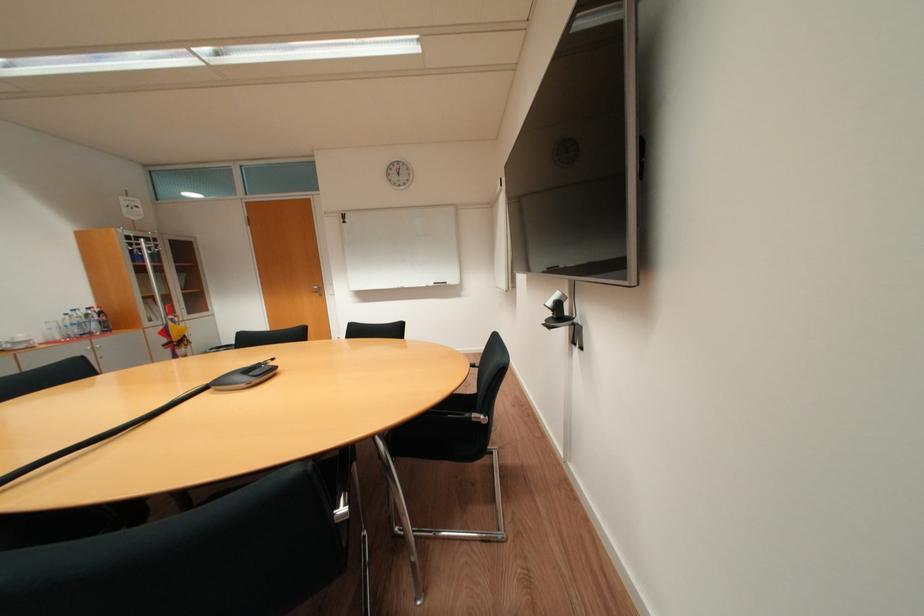
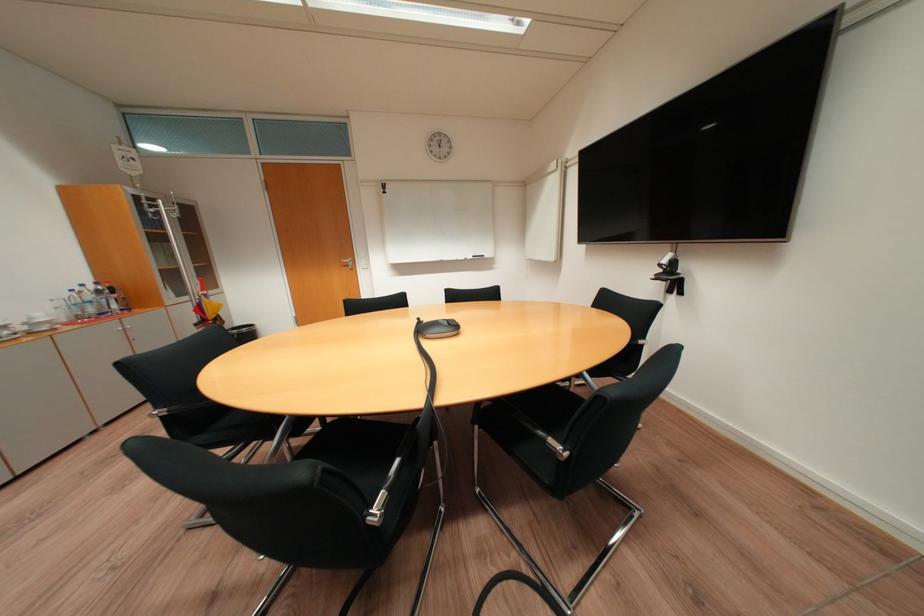
The point at (175, 333) is marked in the first image. Where is the corresponding point in the second image?

(208, 310)